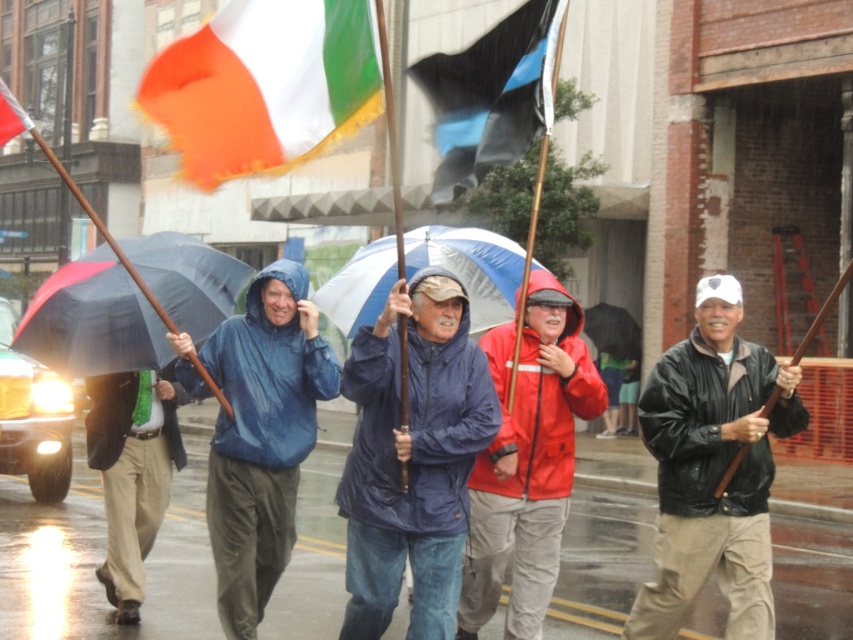
You are a photographer at the event and want to capture both the orange fabric flag at upper left and the black matte umbrella at left in a single shot. Which object should you focus on first to ensure both are in clear view?

The orange fabric flag at upper left is closer to the viewer than the black matte umbrella at left. To ensure both are in clear view, focus on the orange fabric flag at upper left first, as it is nearer and adjusting focus from near to far will help capture both objects effectively.

You are organizing a photo shoot and need to ensure that the black matte flag at center and the khaki cotton pants at center are both visible in the frame. Based on their sizes, which object will require more space in the photo to be fully captured?

The khaki cotton pants at center requires more space in the photo because the black matte flag at center occupies less space than it.

You are a photographer trying to capture a wide shot of the orange fabric flag at upper left and the black matte umbrella at left. Given that your camera can only focus on objects wider than 1 meter, will both items be in focus?

The orange fabric flag at upper left has a width larger than 1 meter since it is wider than the black matte umbrella at left, which may or may not meet the focus requirement. However, without knowing the exact width of the umbrella, we cannot confirm if both are above 1 meter. The question cannot be definitively answered with the given information.